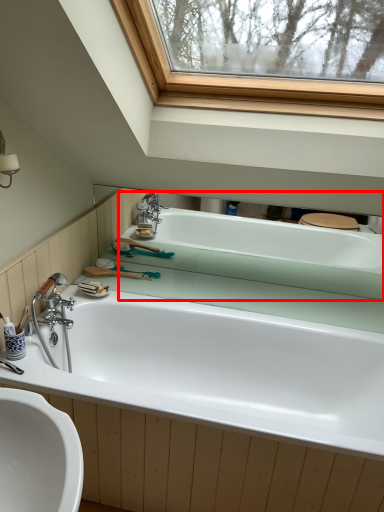
Question: From the image's perspective, considering the relative positions of bathtub (annotated by the red box) and bathtub in the image provided, where is bathtub (annotated by the red box) located with respect to the staircase?

Choices:
 (A) below
 (B) above

Answer: (B)